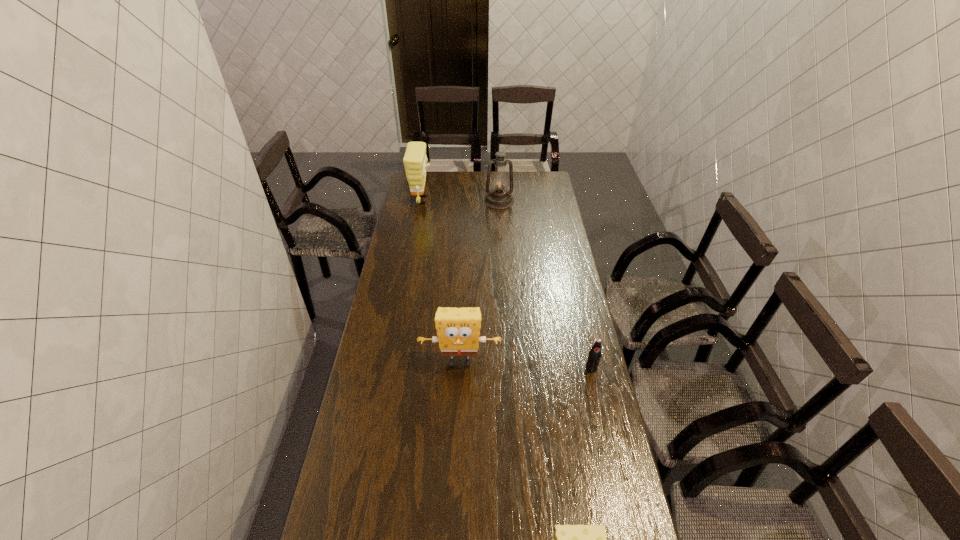
Where is `oil lamp`? The height and width of the screenshot is (540, 960). oil lamp is located at coordinates (499, 198).

Identify the location of the leftmost object. (415, 159).

Locate an element on the screen. The image size is (960, 540). the farthest sponge is located at coordinates (415, 159).

Find the location of a particular element. This screenshot has width=960, height=540. the second shortest sponge is located at coordinates (458, 329).

This screenshot has width=960, height=540. Identify the location of the second nearest sponge. (458, 329).

At what (x,y) coordinates should I click in order to perform the action: click on the shortest object. Please return your answer as a coordinate pair (x, y). The width and height of the screenshot is (960, 540). Looking at the image, I should click on (594, 356).

The image size is (960, 540). I want to click on the rightmost object, so click(594, 356).

The height and width of the screenshot is (540, 960). Identify the location of vacant space located 0.130m on the back of the oil lamp. (498, 180).

The image size is (960, 540). What are the coordinates of `free space located 0.360m on the face of the farthest sponge` in the screenshot? It's located at (502, 199).

Find the location of a particular element. The image size is (960, 540). vacant space positioned on the face of the second nearest sponge is located at coordinates (457, 434).